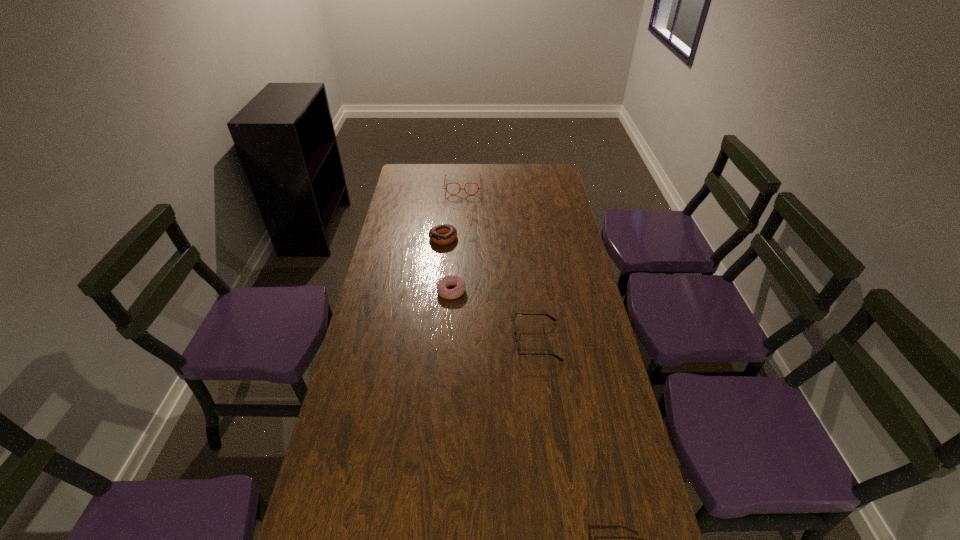
At what (x,y) coordinates should I click in order to perform the action: click on vacant space located on the front-facing side of the shorter spectacles. Please return your answer as a coordinate pair (x, y). Looking at the image, I should click on (401, 341).

The width and height of the screenshot is (960, 540). Find the location of `vacant area situated 0.390m on the front-facing side of the shorter spectacles`. vacant area situated 0.390m on the front-facing side of the shorter spectacles is located at coordinates (392, 341).

The height and width of the screenshot is (540, 960). I want to click on blank area located on the front-facing side of the shorter spectacles, so click(x=410, y=341).

The width and height of the screenshot is (960, 540). In order to click on object at the far edge in this screenshot , I will do (445, 175).

Identify the location of object at the right edge. This screenshot has height=540, width=960. (517, 351).

You are a GUI agent. You are given a task and a screenshot of the screen. Output one action in this format:
    pyautogui.click(x=<x>, y=<y>)
    Task: Click on the vacant region at the far edge of the desktop
    The width and height of the screenshot is (960, 540).
    Given the screenshot: What is the action you would take?
    pyautogui.click(x=502, y=164)

This screenshot has width=960, height=540. I want to click on vacant space at the left edge of the desktop, so click(384, 248).

This screenshot has height=540, width=960. In the image, there is a desktop. In order to click on free space at the right edge in this screenshot , I will do `click(581, 389)`.

Identify the location of free space at the far right corner of the desktop. (547, 165).

Locate an element on the screen. The height and width of the screenshot is (540, 960). vacant space in between the taller spectacles and the third farthest object is located at coordinates (457, 239).